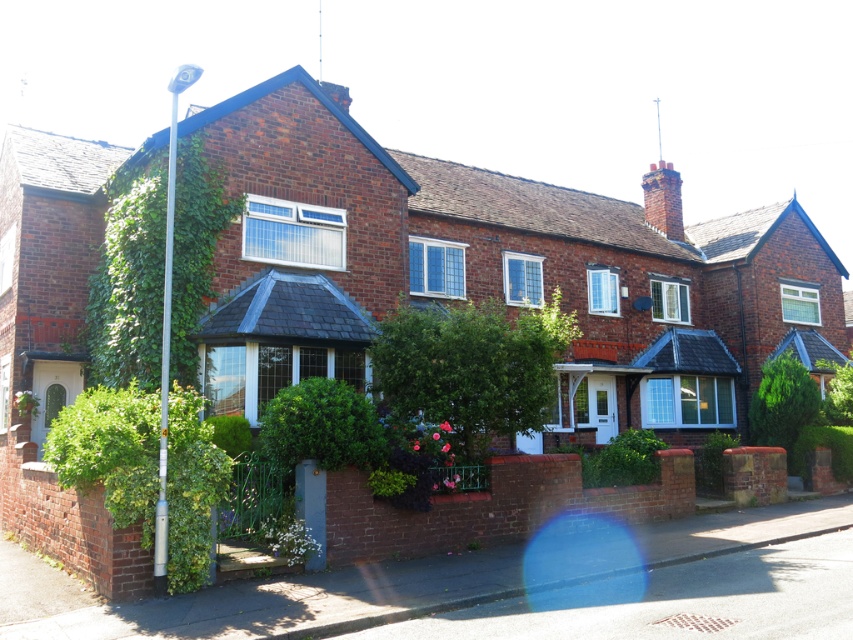
In the scene shown: You are a gardener assessing the growth of ivy on a house. You notice two areas with green leafy ivy at center and green leafy ivy at lower left. Which ivy area is shorter?

The green leafy ivy at center is shorter than the green leafy ivy at lower left.

You are standing in front of the house and notice two areas with green leafy ivy. One is labeled as green leafy ivy at left and the other as green leafy ivy at lower left. Which ivy area is higher up on the wall?

The green leafy ivy at left is positioned over the green leafy ivy at lower left, so the ivy at left is higher up on the wall.